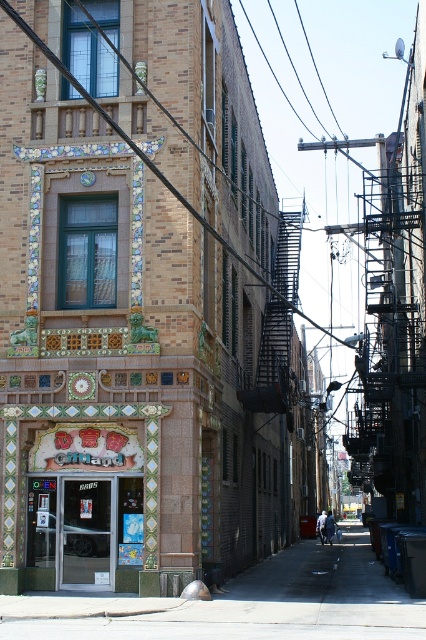
Question: Which of the following is the closest to the observer?

Choices:
 (A) matte green tile storefront at center
 (B) concrete sidewalk at lower center

Answer: (B)

Question: Which of the following is the closest to the observer?

Choices:
 (A) concrete sidewalk at lower center
 (B) matte green tile storefront at center

Answer: (A)

Question: Observing the image, what is the correct spatial positioning of concrete sidewalk at lower center in reference to matte green tile storefront at center?

Choices:
 (A) below
 (B) above

Answer: (A)

Question: Observing the image, what is the correct spatial positioning of concrete sidewalk at lower center in reference to matte green tile storefront at center?

Choices:
 (A) above
 (B) below

Answer: (B)

Question: Can you confirm if concrete sidewalk at lower center is positioned below matte green tile storefront at center?

Choices:
 (A) no
 (B) yes

Answer: (B)